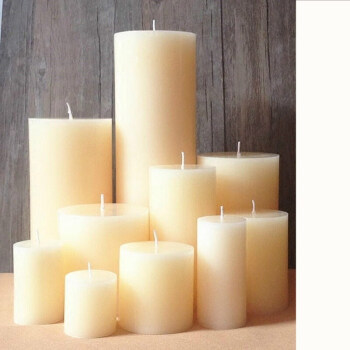
This screenshot has width=350, height=350. In order to click on fat candles in this screenshot , I will do `click(161, 299)`, `click(114, 225)`, `click(247, 185)`, `click(152, 117)`, `click(62, 179)`, `click(277, 274)`.